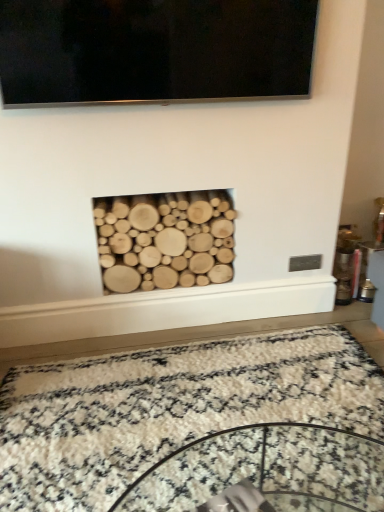
Question: Does black glossy flat-screen tv at upper center have a greater height compared to natural wood logs at center?

Choices:
 (A) no
 (B) yes

Answer: (A)

Question: Is black glossy flat-screen tv at upper center shorter than natural wood logs at center?

Choices:
 (A) no
 (B) yes

Answer: (B)

Question: Is black glossy flat-screen tv at upper center far away from natural wood logs at center?

Choices:
 (A) no
 (B) yes

Answer: (A)

Question: Is black glossy flat-screen tv at upper center to the left of natural wood logs at center from the viewer's perspective?

Choices:
 (A) no
 (B) yes

Answer: (A)

Question: Is black glossy flat-screen tv at upper center not within natural wood logs at center?

Choices:
 (A) no
 (B) yes

Answer: (B)

Question: Does black glossy flat-screen tv at upper center have a smaller size compared to natural wood logs at center?

Choices:
 (A) yes
 (B) no

Answer: (A)

Question: Is there a large distance between natural wood logs at center and black glossy flat-screen tv at upper center?

Choices:
 (A) no
 (B) yes

Answer: (A)

Question: From the image's perspective, is natural wood logs at center below black glossy flat-screen tv at upper center?

Choices:
 (A) yes
 (B) no

Answer: (A)

Question: From the image's perspective, is natural wood logs at center over black glossy flat-screen tv at upper center?

Choices:
 (A) no
 (B) yes

Answer: (A)

Question: Can you confirm if natural wood logs at center is thinner than black glossy flat-screen tv at upper center?

Choices:
 (A) yes
 (B) no

Answer: (B)

Question: Is natural wood logs at center surrounding black glossy flat-screen tv at upper center?

Choices:
 (A) yes
 (B) no

Answer: (B)

Question: Is natural wood logs at center located outside black glossy flat-screen tv at upper center?

Choices:
 (A) no
 (B) yes

Answer: (B)

Question: Is white shaggy rug at center next to black glossy flat-screen tv at upper center?

Choices:
 (A) yes
 (B) no

Answer: (B)